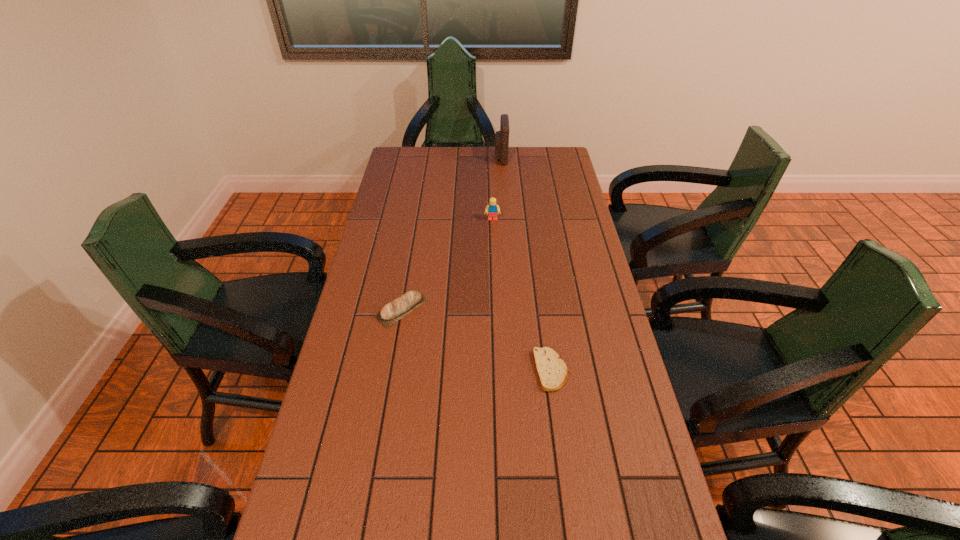
I want to click on vacant space located 0.240m with an open flap on the farthest object, so click(x=442, y=158).

Locate an element on the screen. vacant region located 0.180m on the front-facing side of the Lego is located at coordinates (493, 254).

This screenshot has height=540, width=960. What are the coordinates of `blank area located 0.230m on the back of the leftmost object` in the screenshot? It's located at (413, 242).

This screenshot has height=540, width=960. Find the location of `free region located on the left of the nearest object`. free region located on the left of the nearest object is located at coordinates (459, 370).

Find the location of a particular element. The width and height of the screenshot is (960, 540). object that is at the far edge is located at coordinates (501, 137).

Find the location of a particular element. object located at the left edge is located at coordinates (392, 312).

In order to click on object that is at the right edge in this screenshot , I will do `click(552, 372)`.

Where is `vacant space at the far edge of the desktop`? vacant space at the far edge of the desktop is located at coordinates (481, 150).

Image resolution: width=960 pixels, height=540 pixels. Identify the location of free space at the left edge of the desktop. (359, 393).

Find the location of a particular element. The width and height of the screenshot is (960, 540). vacant space at the right edge of the desktop is located at coordinates [x=591, y=362].